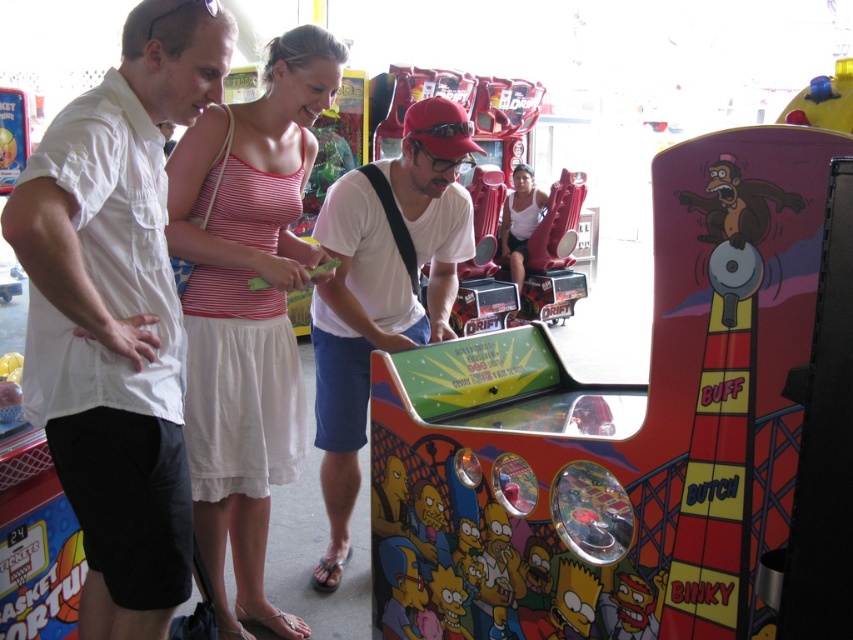
The width and height of the screenshot is (853, 640). Describe the element at coordinates (117, 312) in the screenshot. I see `white cotton shirt at upper left` at that location.

Which is above, white cotton shirt at upper left or white cotton dress at center?

Positioned higher is white cotton dress at center.

This screenshot has height=640, width=853. What do you see at coordinates (117, 312) in the screenshot?
I see `white cotton shirt at upper left` at bounding box center [117, 312].

Image resolution: width=853 pixels, height=640 pixels. Find the location of `white cotton shirt at upper left`. white cotton shirt at upper left is located at coordinates (117, 312).

Does white cotton dress at center appear under white matte shirt at center?

No, white cotton dress at center is not below white matte shirt at center.

Is white cotton dress at center positioned behind white matte shirt at center?

Yes, it is.

Between point (196, 276) and point (341, 348), which one is positioned in front?

Point (196, 276) is in front.

This screenshot has width=853, height=640. I want to click on white cotton dress at center, so click(x=247, y=310).

Does white cotton shirt at upper left come behind white matte shirt at center?

No, it is in front of white matte shirt at center.

Is white cotton shirt at upper left closer to camera compared to white matte shirt at center?

Yes, white cotton shirt at upper left is in front of white matte shirt at center.

Between point (61, 426) and point (357, 429), which one is positioned in front?

Point (61, 426) is in front.

The height and width of the screenshot is (640, 853). I want to click on white cotton shirt at upper left, so pos(117,312).